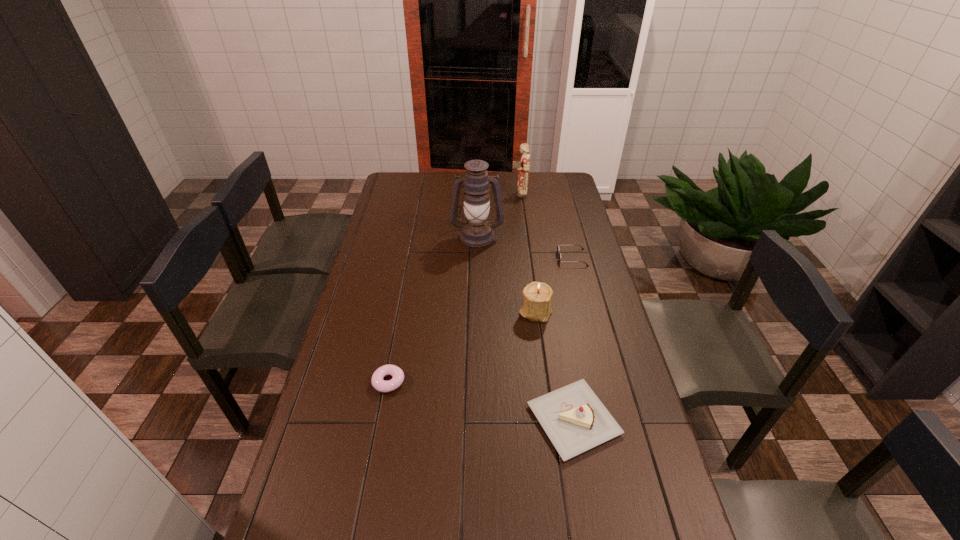
At what (x,y) coordinates should I click in order to perform the action: click on vacant area in the image that satisfies the following two spatial constraints: 1. on the front-facing side of the second tallest object; 2. on the left side of the third shortest object. Please return your answer as a coordinate pair (x, y). The image size is (960, 540). Looking at the image, I should click on click(548, 420).

The image size is (960, 540). In order to click on blank area in the image that satisfies the following two spatial constraints: 1. on the front-facing side of the candle_holder; 2. on the right side of the figurine in this screenshot , I will do (534, 311).

This screenshot has width=960, height=540. Identify the location of vacant space that satisfies the following two spatial constraints: 1. on the back side of the candle_holder; 2. on the front-facing side of the farthest object. (520, 193).

At what (x,y) coordinates should I click in order to perform the action: click on vacant space that satisfies the following two spatial constraints: 1. on the front side of the tallest object; 2. on the left side of the third shortest object. Please return your answer as a coordinate pair (x, y). The width and height of the screenshot is (960, 540). Looking at the image, I should click on (475, 420).